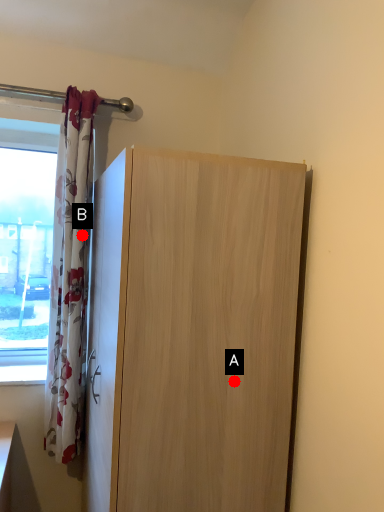
Question: Two points are circled on the image, labeled by A and B beside each circle. Among these points, which one is nearest to the camera?

Choices:
 (A) A is closer
 (B) B is closer

Answer: (A)